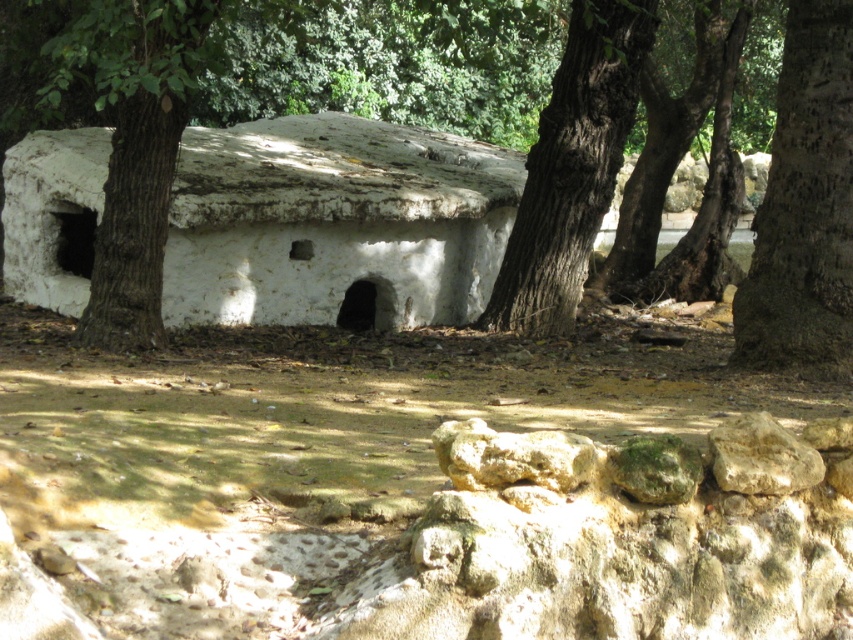
Which is more to the left, brown rough tree at center or white stucco hut at center?

brown rough tree at center is more to the left.

Is brown rough tree at center wider than white stucco hut at center?

In fact, brown rough tree at center might be narrower than white stucco hut at center.

The height and width of the screenshot is (640, 853). I want to click on brown rough tree at center, so click(419, 202).

Based on the photo, which is more to the left, rough bark tree at right or smooth beige rock at lower right?

Positioned to the left is smooth beige rock at lower right.

Can you confirm if rough bark tree at right is smaller than smooth beige rock at lower right?

No.

Does point (846, 161) lie in front of point (767, 432)?

No, (846, 161) is further to viewer.

At what (x,y) coordinates should I click in order to perform the action: click on rough bark tree at right. Please return your answer as a coordinate pair (x, y). The height and width of the screenshot is (640, 853). Looking at the image, I should click on (804, 208).

I want to click on white stucco hut at center, so click(335, 221).

How distant is white stucco hut at center from rough bark tree at right?

white stucco hut at center and rough bark tree at right are 3.86 meters apart.

Which is behind, point (56, 150) or point (833, 60)?

The point (56, 150) is behind.

Where is `white stucco hut at center`? white stucco hut at center is located at coordinates (335, 221).